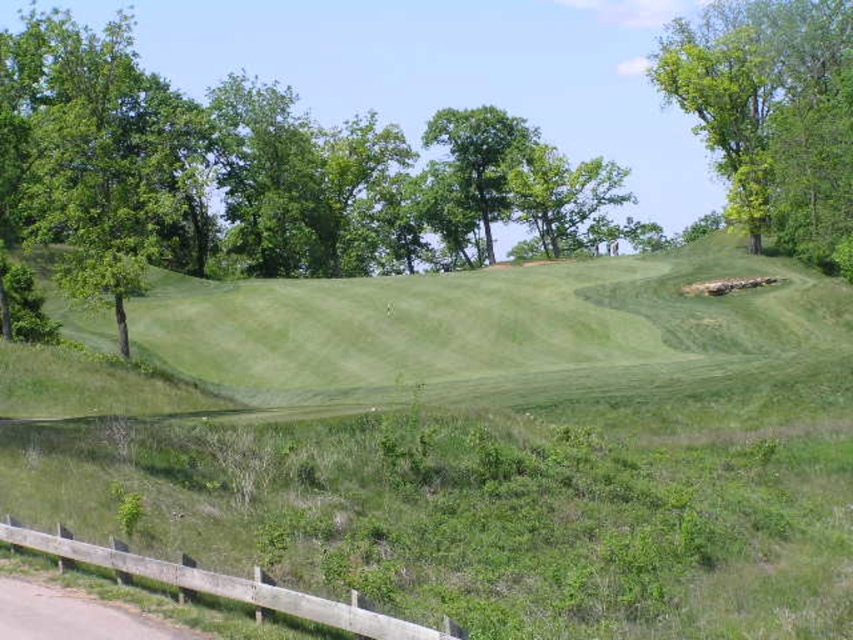
Consider the image. You are standing at the bottom of the hill and want to walk to the point at coordinates point [177,333] and point [422,131]. Which point will you reach first?

You will reach point [177,333] first because it is closer to the camera than point [422,131], meaning it is physically nearer to your current position at the bottom of the hill.

You are a gardener planning to plant a new row of flowers between the green grassy hill at center and the green leafy tree at center. Given their widths, which object should you place the flowers closer to to ensure they have enough space to grow?

The green grassy hill at center is wider than the green leafy tree at center, so you should place the flowers closer to the green grassy hill at center to ensure they have enough space to grow.